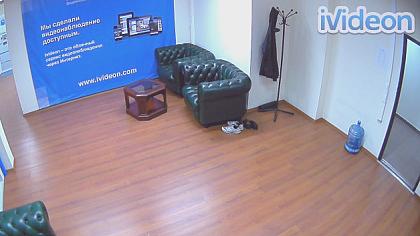
I want to click on water jug, so click(x=355, y=143).